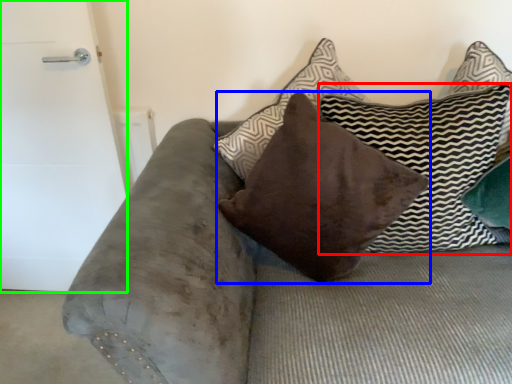
Question: Based on their relative distances, which object is farther from pillow (highlighted by a red box)? Choose from pillow (highlighted by a blue box) and door (highlighted by a green box).

Choices:
 (A) pillow
 (B) door

Answer: (B)